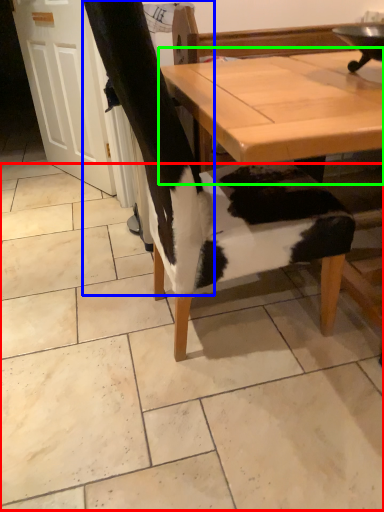
Question: Which is farther away from tile (highlighted by a red box)? leg (highlighted by a blue box) or table (highlighted by a green box)?

Choices:
 (A) leg
 (B) table

Answer: (B)